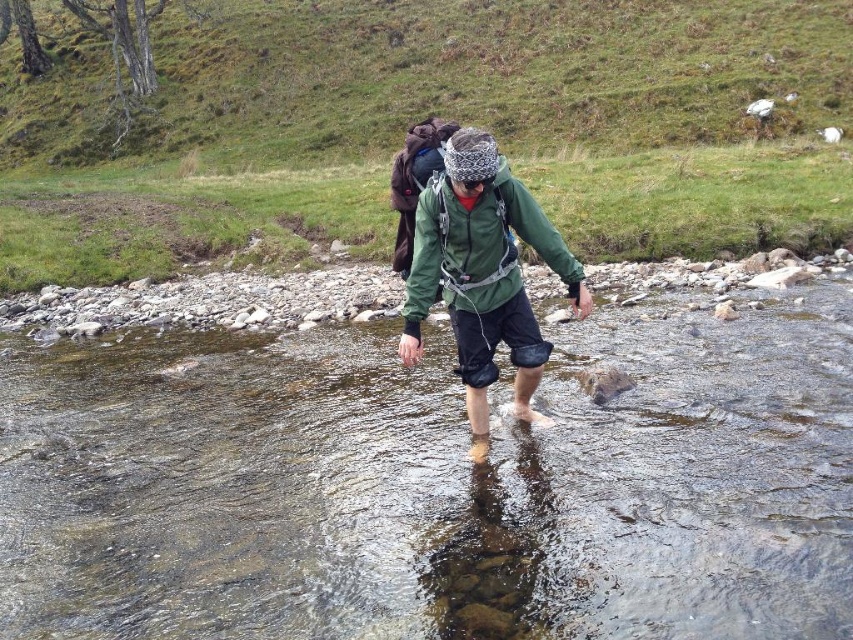
Question: Is clear water at center positioned behind green grass at upper center?

Choices:
 (A) yes
 (B) no

Answer: (B)

Question: Is clear water at center wider than green grass at upper center?

Choices:
 (A) no
 (B) yes

Answer: (A)

Question: Among these objects, which one is farthest from the camera?

Choices:
 (A) clear water at center
 (B) green matte jacket at center
 (C) green grass at upper center

Answer: (C)

Question: Which point is farther from the camera taking this photo?

Choices:
 (A) (741, 595)
 (B) (347, 102)
 (C) (432, 257)

Answer: (B)

Question: Which object appears closest to the camera in this image?

Choices:
 (A) green grass at upper center
 (B) clear water at center

Answer: (B)

Question: Can you confirm if green grass at upper center is wider than green matte jacket at center?

Choices:
 (A) no
 (B) yes

Answer: (B)